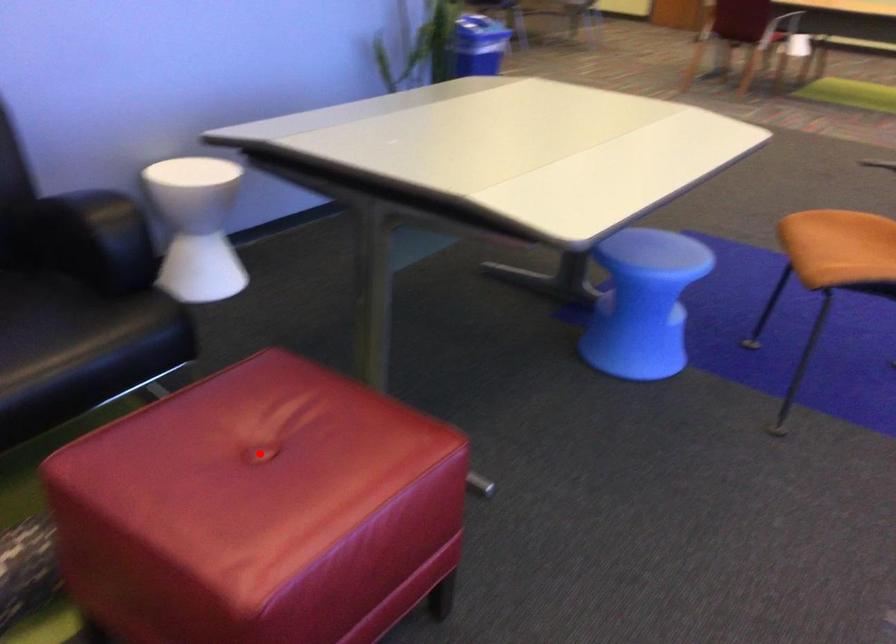
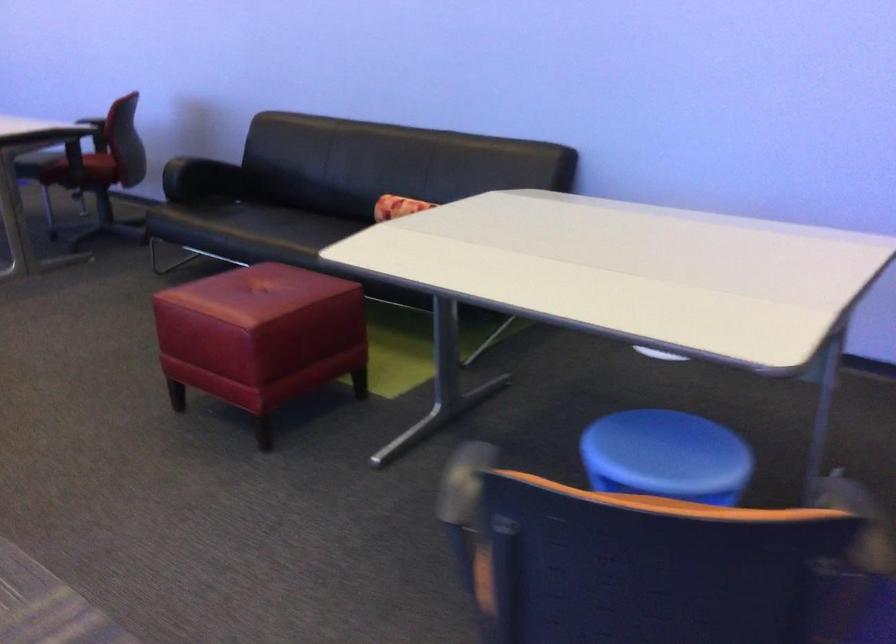
Locate, in the second image, the point that corresponds to the highlighted location in the first image.

(260, 292)